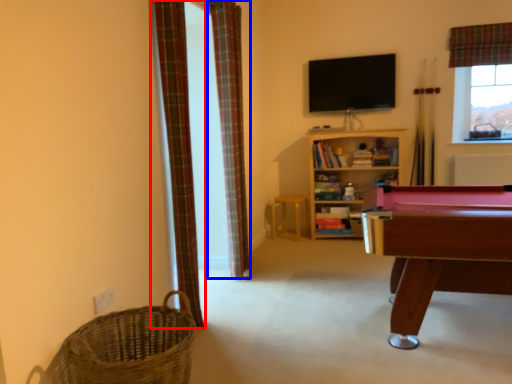
Question: Which object appears farthest to the camera in this image, curtain (highlighted by a red box) or curtain (highlighted by a blue box)?

Choices:
 (A) curtain
 (B) curtain

Answer: (B)